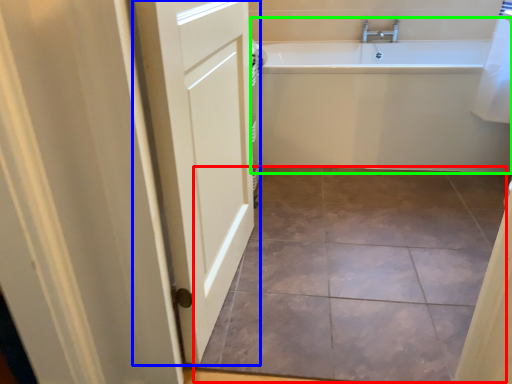
Question: Which object is positioned farthest from ceramic tile (highlighted by a red box)? Select from door (highlighted by a blue box) and bathtub (highlighted by a green box).

Choices:
 (A) door
 (B) bathtub

Answer: (B)